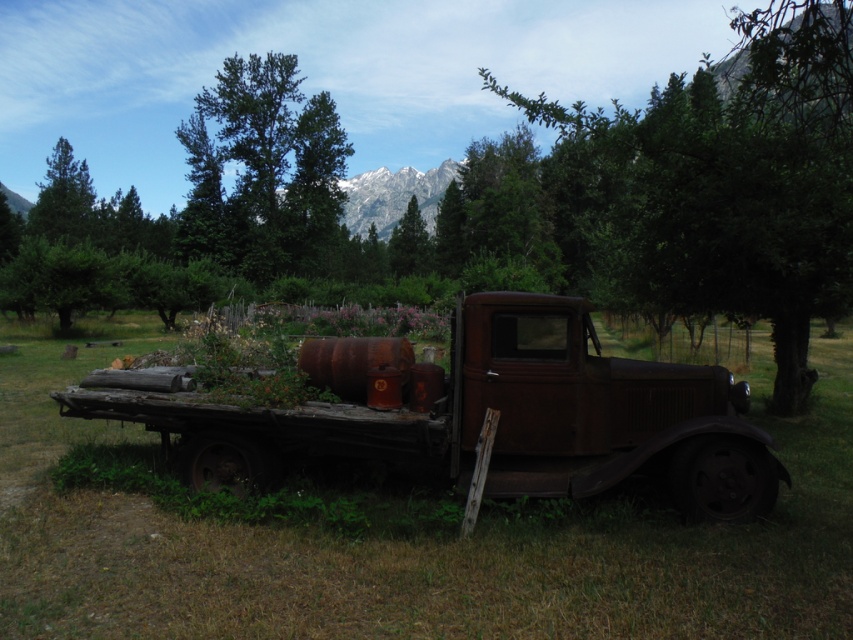
Question: Which object appears closest to the camera in this image?

Choices:
 (A) green leafy tree at upper center
 (B) green matte tree at center
 (C) rusty metal truck at center
 (D) green leafy tree at center

Answer: (D)

Question: Does green leafy tree at upper center have a larger size compared to green matte tree at center?

Choices:
 (A) yes
 (B) no

Answer: (A)

Question: Does green leafy tree at upper center appear on the right side of green matte tree at center?

Choices:
 (A) no
 (B) yes

Answer: (A)

Question: Which point is closer to the camera?

Choices:
 (A) (409, 204)
 (B) (471, 344)
 (C) (792, 285)

Answer: (B)

Question: Which object appears closest to the camera in this image?

Choices:
 (A) green leafy tree at upper center
 (B) rusty metal truck at center
 (C) green leafy tree at center
 (D) green matte tree at center

Answer: (C)

Question: Is rusty metal truck at center behind green leafy tree at upper center?

Choices:
 (A) no
 (B) yes

Answer: (A)